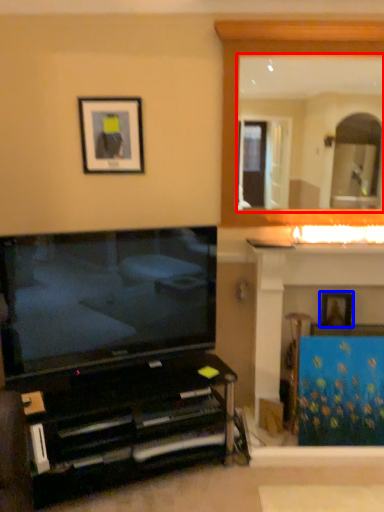
Question: Which of the following is the closest to the observer, mirror (highlighted by a red box) or picture frame (highlighted by a blue box)?

Choices:
 (A) mirror
 (B) picture frame

Answer: (A)